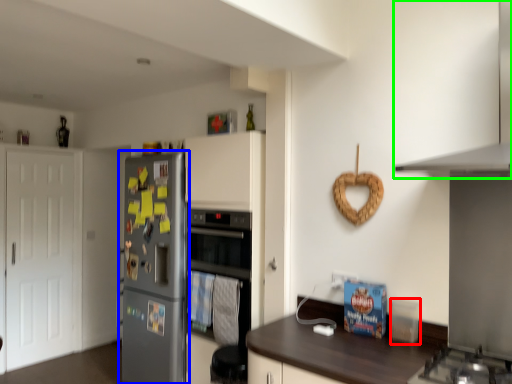
Question: Based on their relative distances, which object is farther from appliance (highlighted by a red box)? Choose from refrigerator (highlighted by a blue box) and exhaust hood (highlighted by a green box).

Choices:
 (A) refrigerator
 (B) exhaust hood

Answer: (A)